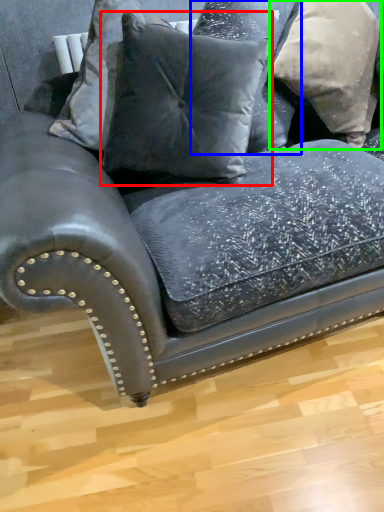
Question: Based on their relative distances, which object is nearer to pillow (highlighted by a red box)? Choose from pillow (highlighted by a blue box) and pillow (highlighted by a green box).

Choices:
 (A) pillow
 (B) pillow

Answer: (A)